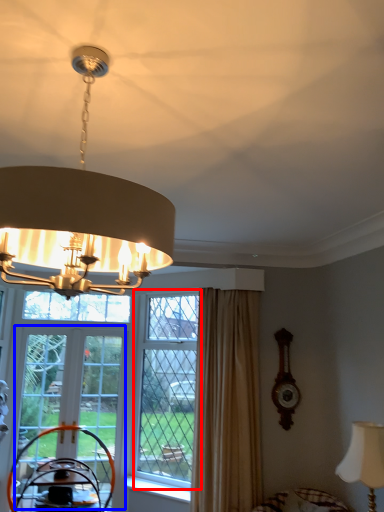
Question: Among these objects, which one is nearest to the camera, window (highlighted by a red box) or screen door (highlighted by a blue box)?

Choices:
 (A) window
 (B) screen door

Answer: (A)